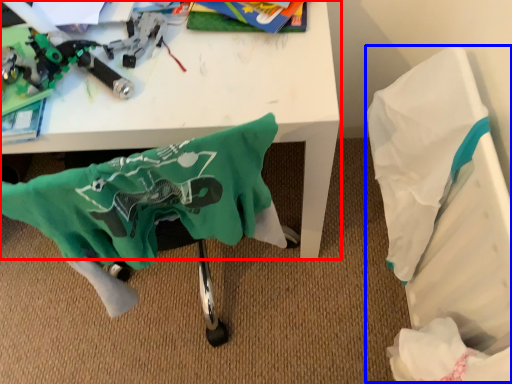
Question: Among these objects, which one is nearest to the camera, table (highlighted by a red box) or wrapping paper (highlighted by a blue box)?

Choices:
 (A) table
 (B) wrapping paper

Answer: (A)